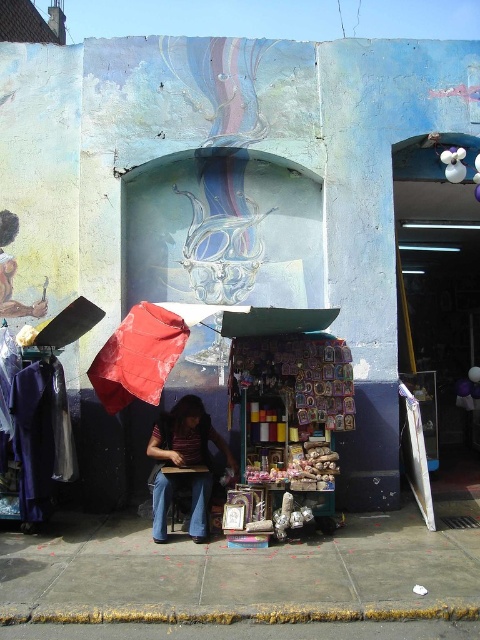
Can you confirm if concrete sidewalk at center is thinner than concrete curb at lower center?

In fact, concrete sidewalk at center might be wider than concrete curb at lower center.

Is point (49, 611) positioned after point (298, 621)?

No, (49, 611) is closer to viewer.

Locate an element on the screen. The width and height of the screenshot is (480, 640). concrete sidewalk at center is located at coordinates (240, 573).

Does concrete curb at lower center have a smaller size compared to striped fabric umbrella at center?

Yes, concrete curb at lower center is smaller than striped fabric umbrella at center.

Does concrete curb at lower center appear under striped fabric umbrella at center?

Correct, concrete curb at lower center is located below striped fabric umbrella at center.

Measure the distance between concrete curb at lower center and camera.

They are 11.90 feet apart.

You are a GUI agent. You are given a task and a screenshot of the screen. Output one action in this format:
    pyautogui.click(x=<x>, y=<y>)
    Task: Click on the concrete curb at lower center
    The width and height of the screenshot is (480, 640).
    Given the screenshot: What is the action you would take?
    pyautogui.click(x=236, y=612)

Does concrete sidewalk at center come in front of striped fabric umbrella at center?

Yes, it is in front of striped fabric umbrella at center.

Between point (384, 605) and point (152, 458), which one is positioned in front?

Point (384, 605) is in front.

Find the location of a particular element. concrete sidewalk at center is located at coordinates [x=240, y=573].